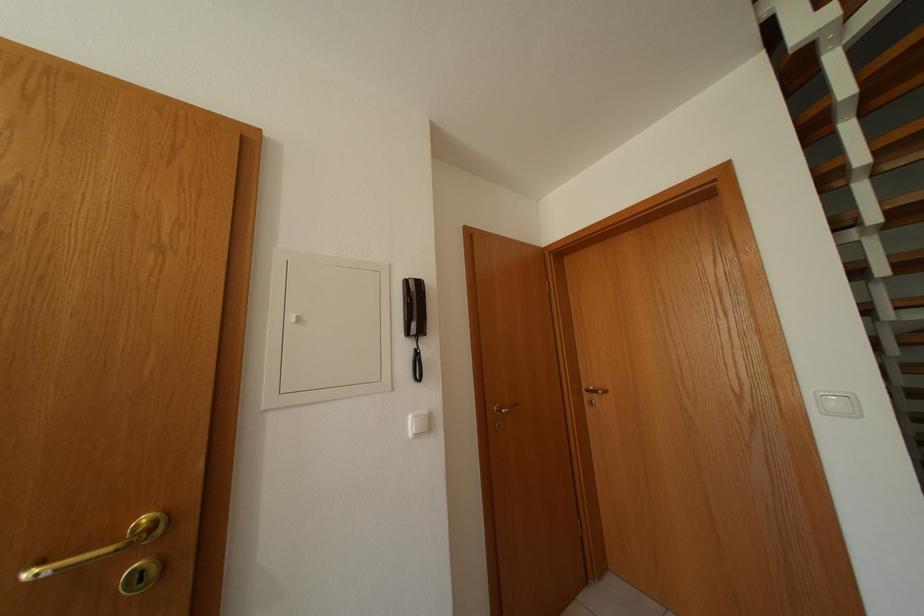
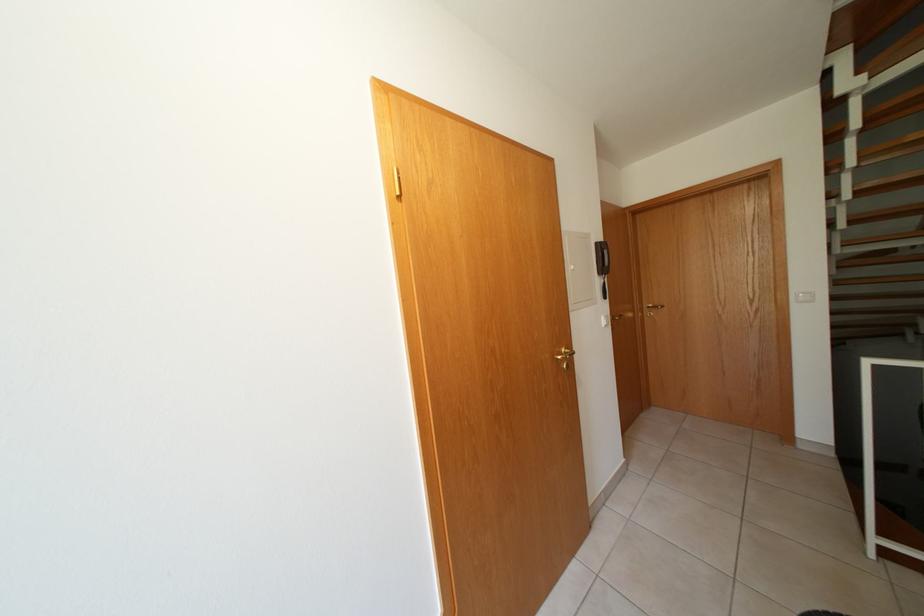
The point at (419, 423) is marked in the first image. Where is the corresponding point in the second image?

(611, 323)